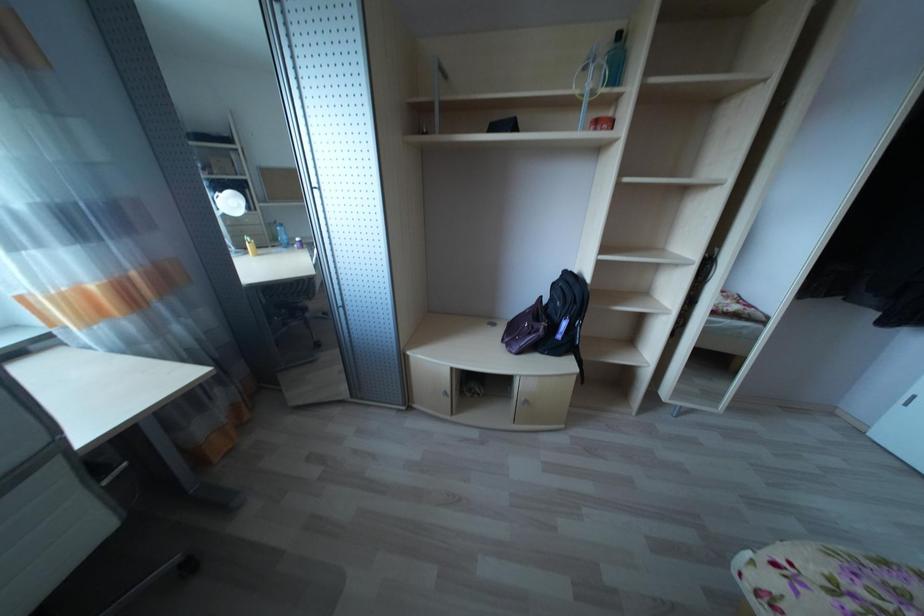
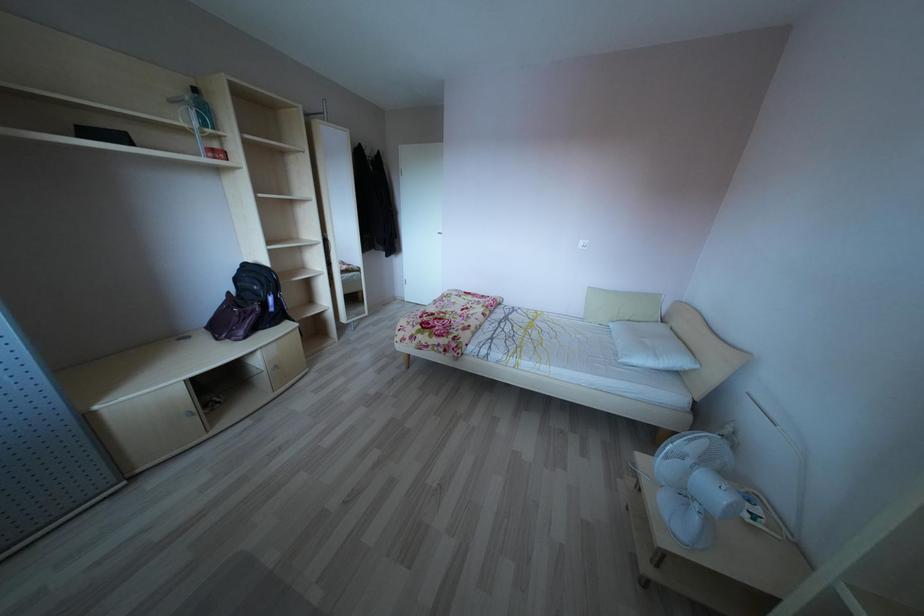
The first image is from the beginning of the video and the second image is from the end. How did the camera likely rotate when shooting the video?

The camera's rotation is toward right-down.